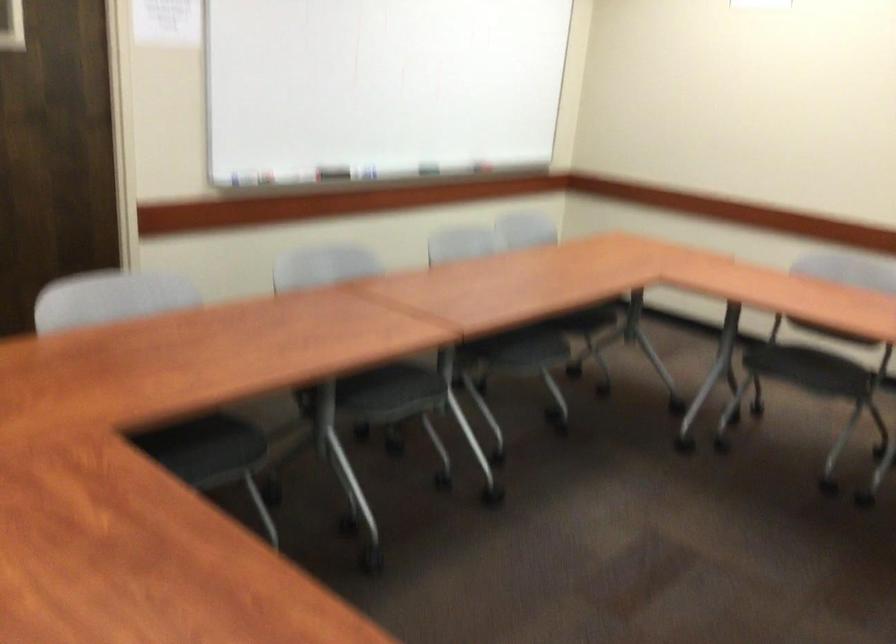
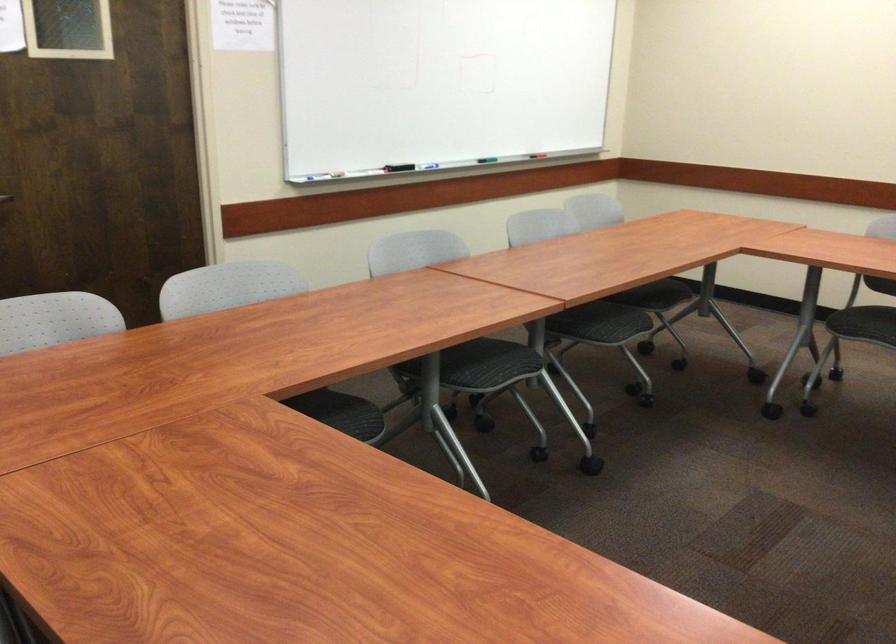
Find the pixel in the second image that matches (x=382, y=91) in the first image.

(438, 82)